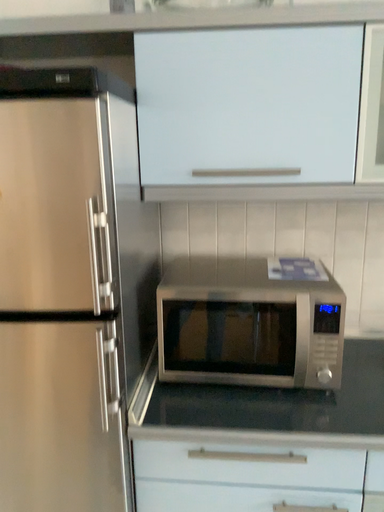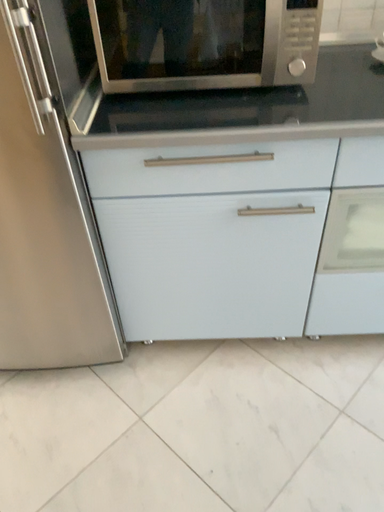
Question: How did the camera likely rotate when shooting the video?

Choices:
 (A) rotated downward
 (B) rotated upward

Answer: (A)